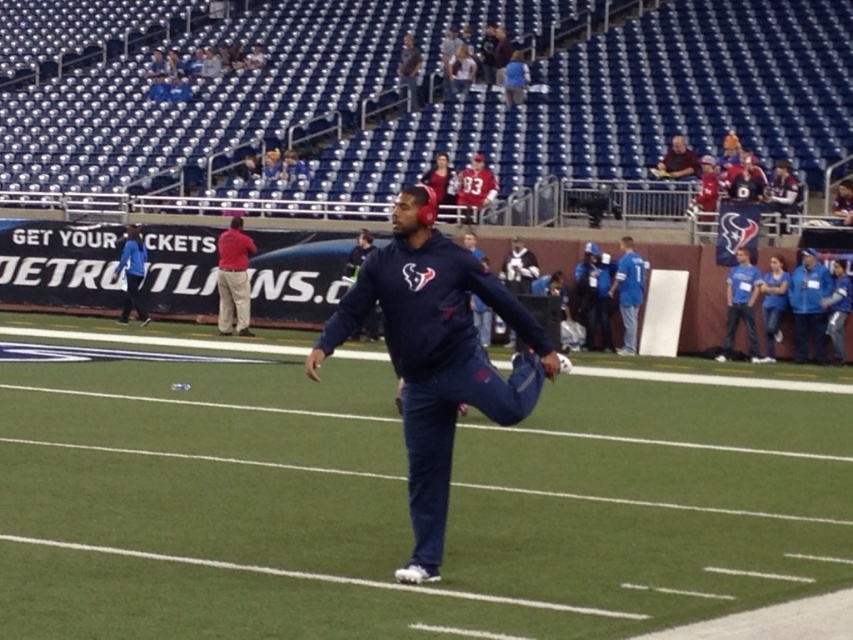
You are a photographer positioned at the center of the field. You want to take a photo of the blue jersey at right without moving from your current position. Is the dark blue pants at center blocking your view? Please explain.

The dark blue pants at center is 7.03 meters away from the blue jersey at right. Since you are at the center, the dark blue pants at center would be between you and the blue jersey at right, blocking your view unless there is enough space. However, the distance between them is 7.03 meters, so if the photographer is positioned exactly at the center, the dark blue pants at center would block the direct line of sight to the blue jersey at right unless the photographer can adjust their angle or the subjects are

You are a photographer positioned at the edge of the field. You want to take a photo of the blue fleece jacket at upper center without the blue cotton shirt at right blocking it. Can you adjust your position to do so?

The blue cotton shirt at right is in front of the blue fleece jacket at upper center, so moving your position might allow you to capture the blue fleece jacket at upper center without obstruction from the blue cotton shirt at right. Try moving to the left or right to find an angle where the blue cotton shirt at right is no longer blocking the view.